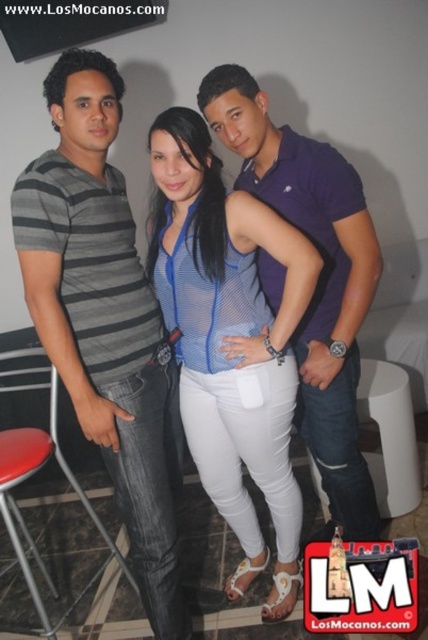
Is purple cotton polo shirt at center wider than white plastic stool at center?

Correct, the width of purple cotton polo shirt at center exceeds that of white plastic stool at center.

Can you confirm if purple cotton polo shirt at center is smaller than white plastic stool at center?

Incorrect, purple cotton polo shirt at center is not smaller in size than white plastic stool at center.

Does point (350, 300) come farther from viewer compared to point (412, 417)?

No, it is in front of (412, 417).

Locate an element on the screen. purple cotton polo shirt at center is located at coordinates (318, 280).

Between gray striped shirt at left and blue mesh top at center, which one appears on the left side from the viewer's perspective?

gray striped shirt at left

Which is above, gray striped shirt at left or blue mesh top at center?

gray striped shirt at left is above.

The image size is (428, 640). I want to click on gray striped shirt at left, so click(106, 321).

Who is positioned more to the left, gray striped shirt at left or red plastic stool at lower left?

red plastic stool at lower left is more to the left.

Is point (98, 147) less distant than point (11, 525)?

Yes, point (98, 147) is closer to viewer.

Who is more distant from viewer, (125, 385) or (8, 452)?

Positioned behind is point (8, 452).

The image size is (428, 640). Identify the location of gray striped shirt at left. (106, 321).